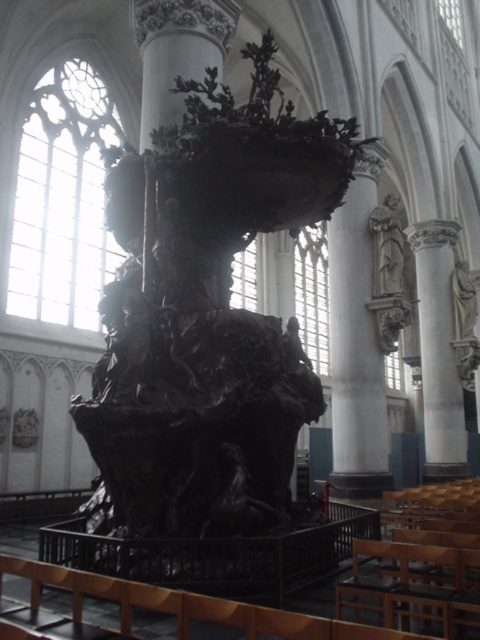
Describe the element at coordinates (357, 340) in the screenshot. I see `white marble statue at center` at that location.

How distant is white marble statue at center from white marble statue at right?

white marble statue at center and white marble statue at right are 19.79 meters apart from each other.

Does point (331, 365) lie behind point (419, 321)?

Yes, point (331, 365) is behind point (419, 321).

This screenshot has height=640, width=480. I want to click on white marble statue at center, so click(x=357, y=340).

Between point (377, 148) and point (389, 225), which one is positioned in front?

Point (389, 225) is in front.

Which is more to the left, white marble statue at center or polished stone statue at right?

white marble statue at center is more to the left.

Which is behind, point (379, 147) or point (404, 260)?

The point (404, 260) is behind.

This screenshot has height=640, width=480. Identify the location of white marble statue at center. (357, 340).

Does point (431, 362) come in front of point (399, 230)?

No, (431, 362) is behind (399, 230).

Find the location of `white marble statue at right`. white marble statue at right is located at coordinates (439, 349).